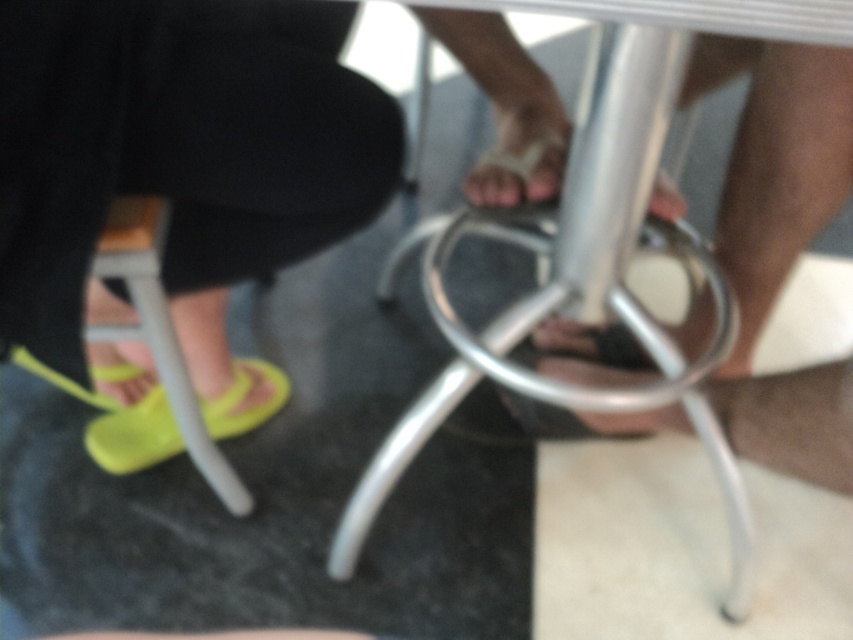
You are trying to place a small plant pot between the wooden seat at lower left and the yellow rubber sandal at lower left. Based on their widths, will there be enough space for the pot?

The wooden seat at lower left has a lesser width compared to yellow rubber sandal at lower left, so there might not be enough space between them for the plant pot.